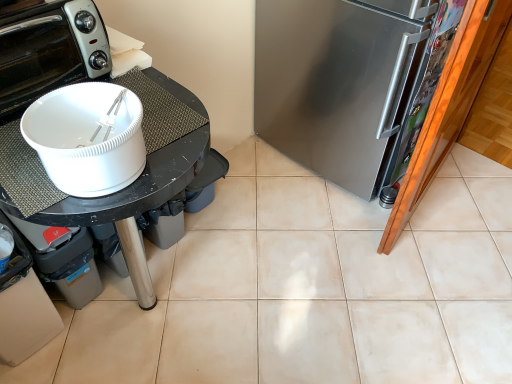
Question: Is black matte table at left spatially inside satin silver refrigerator at right, or outside of it?

Choices:
 (A) inside
 (B) outside

Answer: (B)

Question: Visually, is black matte table at left positioned to the left or to the right of satin silver refrigerator at right?

Choices:
 (A) right
 (B) left

Answer: (B)

Question: Which is farther from the white glossy toaster oven at upper left?

Choices:
 (A) satin silver refrigerator at right
 (B) black matte table at left

Answer: (A)

Question: Which of these objects is positioned farthest from the white glossy toaster oven at upper left?

Choices:
 (A) satin silver refrigerator at right
 (B) black matte table at left

Answer: (A)